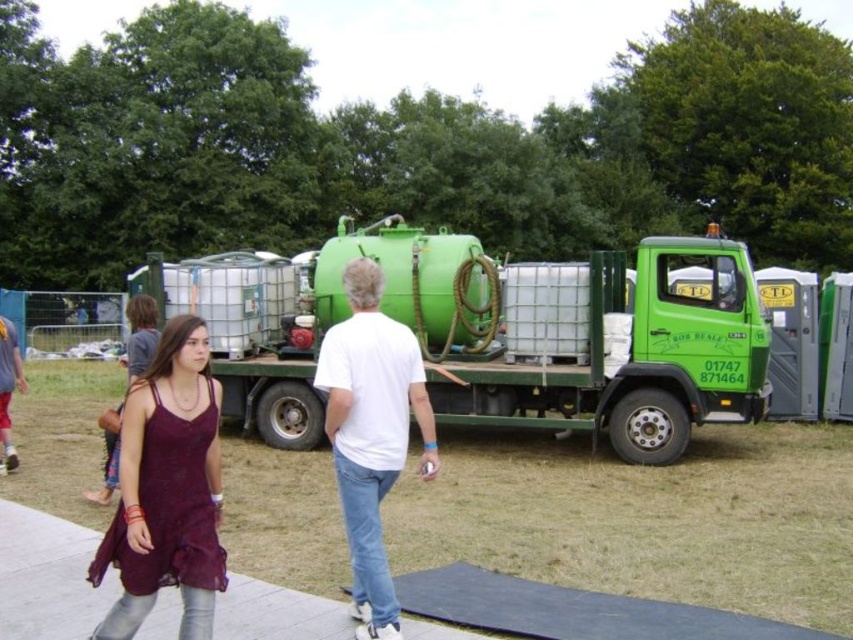
Based on the photo, is green matte truck at center thinner than white concrete pavement at lower center?

Incorrect, green matte truck at center's width is not less than white concrete pavement at lower center's.

Between green matte truck at center and white concrete pavement at lower center, which one appears on the left side from the viewer's perspective?

white concrete pavement at lower center is more to the left.

Measure the distance between point (486,282) and camera.

Point (486,282) and camera are 33.90 feet apart.

Where is `green matte truck at center`? green matte truck at center is located at coordinates (517, 337).

Is green matte truck at center above burgundy lace dress at center?

Yes.

Does point (306, 404) come behind point (154, 369)?

That is True.

At what (x,y) coordinates should I click in order to perform the action: click on green matte truck at center. Please return your answer as a coordinate pair (x, y). Looking at the image, I should click on (517, 337).

Does burgundy lace dress at center lie behind white matte shirt at center?

No.

What do you see at coordinates (167, 490) in the screenshot? This screenshot has height=640, width=853. I see `burgundy lace dress at center` at bounding box center [167, 490].

Identify the location of burgundy lace dress at center. This screenshot has width=853, height=640. (167, 490).